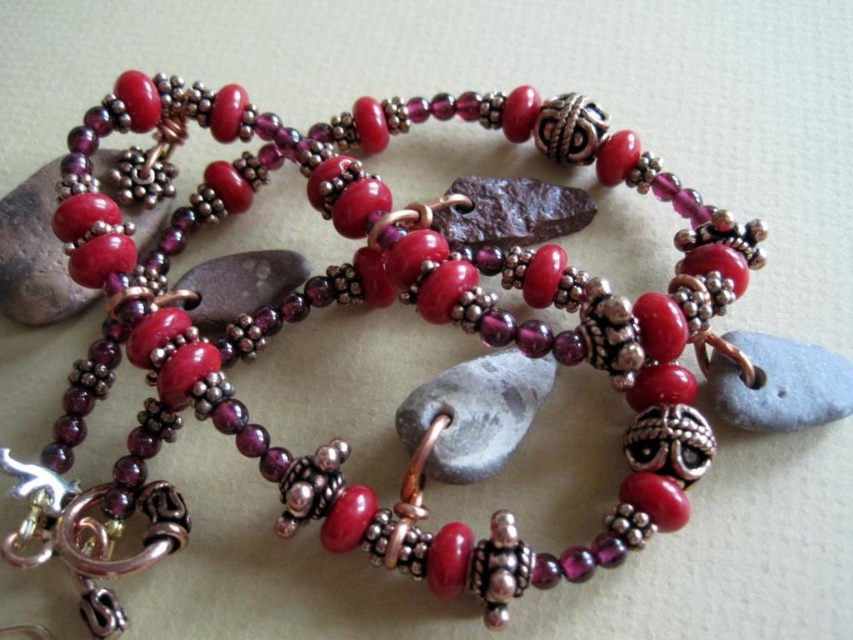
Question: Is matte silver stone at upper left closer to camera compared to gray matte stone at center?

Choices:
 (A) yes
 (B) no

Answer: (B)

Question: Is matte silver stone at upper left wider than gray matte stone at center?

Choices:
 (A) yes
 (B) no

Answer: (A)

Question: Which object appears farthest from the camera in this image?

Choices:
 (A) gray matte stone at center
 (B) matte silver stone at upper left

Answer: (B)

Question: Among these points, which one is nearest to the camera?

Choices:
 (A) (717, 408)
 (B) (18, 234)

Answer: (A)

Question: Does matte silver stone at upper left have a greater width compared to gray matte stone at center?

Choices:
 (A) yes
 (B) no

Answer: (A)

Question: Which object appears farthest from the camera in this image?

Choices:
 (A) gray matte stone at center
 (B) matte silver stone at upper left

Answer: (B)